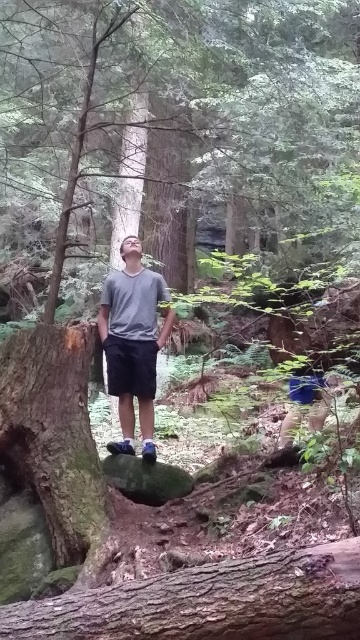
Who is taller, smooth brown tree trunk at left or gray matte shirt at center?

gray matte shirt at center is taller.

From the picture: Can you confirm if smooth brown tree trunk at left is taller than gray matte shirt at center?

No, smooth brown tree trunk at left is not taller than gray matte shirt at center.

Which is behind, point (9, 451) or point (129, 280)?

The point (129, 280) is behind.

Locate an element on the screen. This screenshot has width=360, height=640. smooth brown tree trunk at left is located at coordinates (55, 435).

What do you see at coordinates (183, 118) in the screenshot?
I see `green rough bark tree at center` at bounding box center [183, 118].

Is green rough bark tree at center wider than gray matte shirt at center?

Yes, green rough bark tree at center is wider than gray matte shirt at center.

Who is more forward, (218, 102) or (154, 387)?

Point (154, 387)

The width and height of the screenshot is (360, 640). Identify the location of green rough bark tree at center. (183, 118).

Does brown rough bark tree trunk at lower center appear on the left side of smooth brown tree trunk at left?

In fact, brown rough bark tree trunk at lower center is to the right of smooth brown tree trunk at left.

Is brown rough bark tree trunk at lower center bigger than smooth brown tree trunk at left?

No, brown rough bark tree trunk at lower center is not bigger than smooth brown tree trunk at left.

Who is more forward, (x=97, y=636) or (x=86, y=360)?

Point (x=97, y=636) is more forward.

Where is `brown rough bark tree trunk at lower center`? brown rough bark tree trunk at lower center is located at coordinates (210, 602).